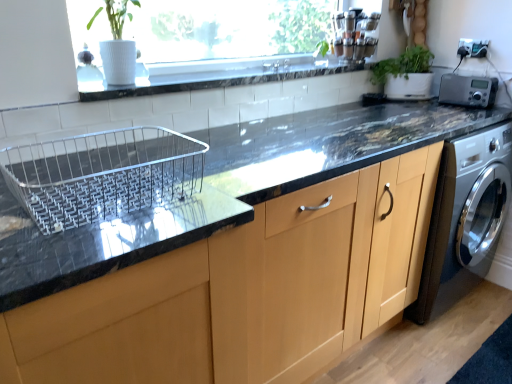
Question: From a real-world perspective, is silver metallic radio at upper right located higher than matte wood cabinet at center?

Choices:
 (A) yes
 (B) no

Answer: (A)

Question: Is matte wood cabinet at center surrounded by silver metallic radio at upper right?

Choices:
 (A) yes
 (B) no

Answer: (B)

Question: Is silver metallic radio at upper right facing towards matte wood cabinet at center?

Choices:
 (A) no
 (B) yes

Answer: (A)

Question: Is silver metallic radio at upper right next to matte wood cabinet at center and touching it?

Choices:
 (A) yes
 (B) no

Answer: (B)

Question: Considering the relative sizes of silver metallic radio at upper right and matte wood cabinet at center in the image provided, is silver metallic radio at upper right shorter than matte wood cabinet at center?

Choices:
 (A) yes
 (B) no

Answer: (A)

Question: Is silver metallic radio at upper right wider than matte wood cabinet at center?

Choices:
 (A) yes
 (B) no

Answer: (B)

Question: Is silver metallic radio at upper right at the right side of white tile at upper center?

Choices:
 (A) yes
 (B) no

Answer: (A)

Question: Is silver metallic radio at upper right bigger than white tile at upper center?

Choices:
 (A) no
 (B) yes

Answer: (A)

Question: Does silver metallic radio at upper right come behind white tile at upper center?

Choices:
 (A) yes
 (B) no

Answer: (A)

Question: Are silver metallic radio at upper right and white tile at upper center beside each other?

Choices:
 (A) yes
 (B) no

Answer: (B)

Question: Does silver metallic radio at upper right come in front of white tile at upper center?

Choices:
 (A) yes
 (B) no

Answer: (B)

Question: From the image's perspective, is silver metallic radio at upper right located above white tile at upper center?

Choices:
 (A) yes
 (B) no

Answer: (B)

Question: From a real-world perspective, is silver metallic radio at upper right beneath green matte plant at upper right?

Choices:
 (A) no
 (B) yes

Answer: (B)